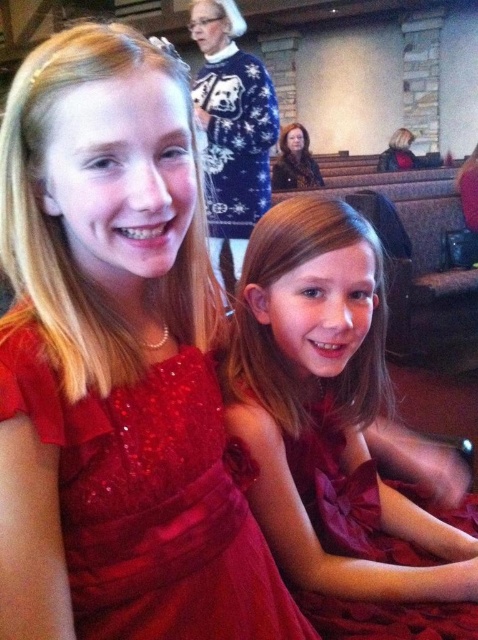
Is point (386, 316) positioned behind point (33, 404)?

Yes, it is.

Locate an element on the screen. The height and width of the screenshot is (640, 478). satin red dress at center is located at coordinates (336, 435).

Does shiny red dress at center appear over blue fuzzy sweater at upper center?

Incorrect, shiny red dress at center is not positioned above blue fuzzy sweater at upper center.

Image resolution: width=478 pixels, height=640 pixels. I want to click on shiny red dress at center, so click(x=150, y=500).

Who is more forward, (87, 516) or (258, 140)?

Positioned in front is point (87, 516).

Find the location of a particular element. shiny red dress at center is located at coordinates (150, 500).

Looking at this image, is satin red dress at center further to camera compared to blue fuzzy sweater at upper center?

No, it is in front of blue fuzzy sweater at upper center.

Between satin red dress at center and blue fuzzy sweater at upper center, which one has more height?

blue fuzzy sweater at upper center is taller.

Locate an element on the screen. The width and height of the screenshot is (478, 640). satin red dress at center is located at coordinates (336, 435).